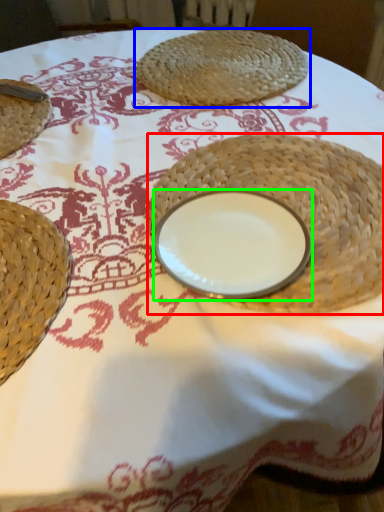
Question: Estimate the real-world distances between objects in this image. Which object is closer to straw hat (highlighted by a red box), food (highlighted by a blue box) or tableware (highlighted by a green box)?

Choices:
 (A) food
 (B) tableware

Answer: (B)